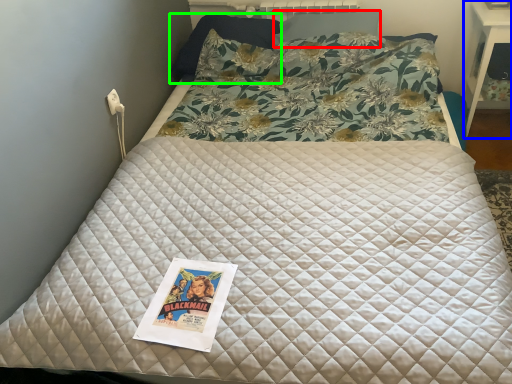
Question: Which object is positioned closest to pillow (highlighted by a red box)? Select from table (highlighted by a blue box) and pillow (highlighted by a green box).

Choices:
 (A) table
 (B) pillow

Answer: (B)